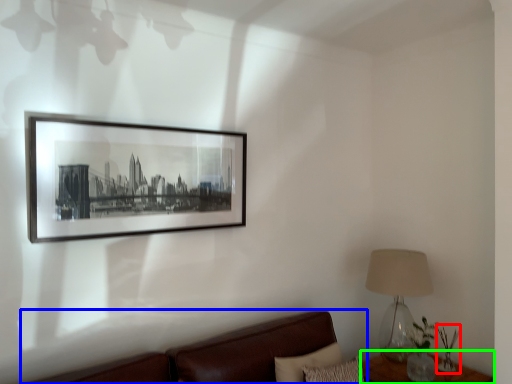
Question: Considering the real-world distances, which object is closest to plant (highlighted by a red box)? studio couch (highlighted by a blue box) or table (highlighted by a green box).

Choices:
 (A) studio couch
 (B) table

Answer: (B)